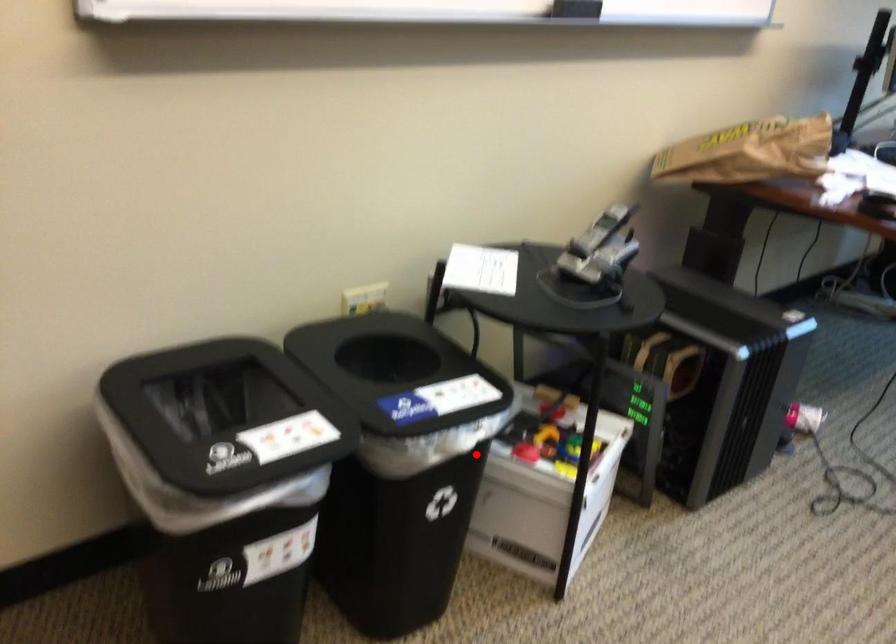
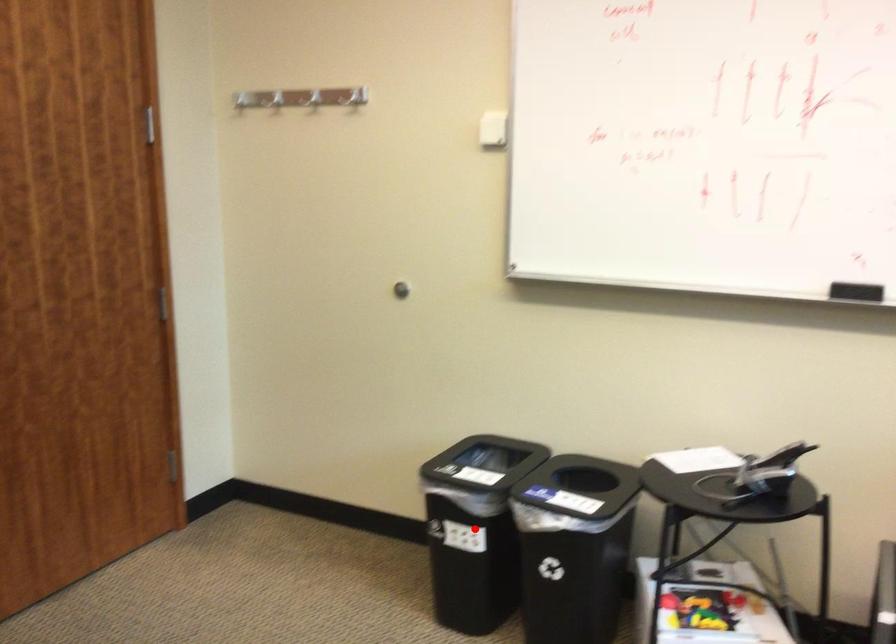
I am providing you with two images of the same scene from different viewpoints. A red point is marked on the first image and another point is marked on the second image. Is the marked point in image1 the same physical position as the marked point in image2?

No